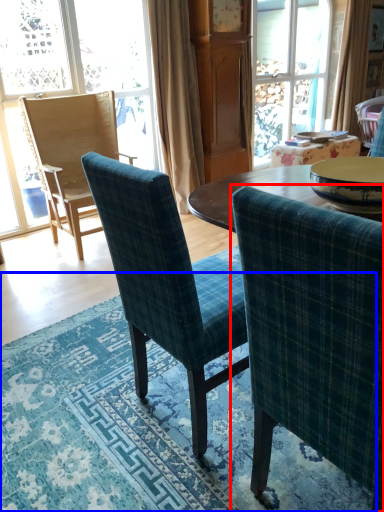
Question: Which object appears farthest to the camera in this image, chair (highlighted by a red box) or mat (highlighted by a blue box)?

Choices:
 (A) chair
 (B) mat

Answer: (B)